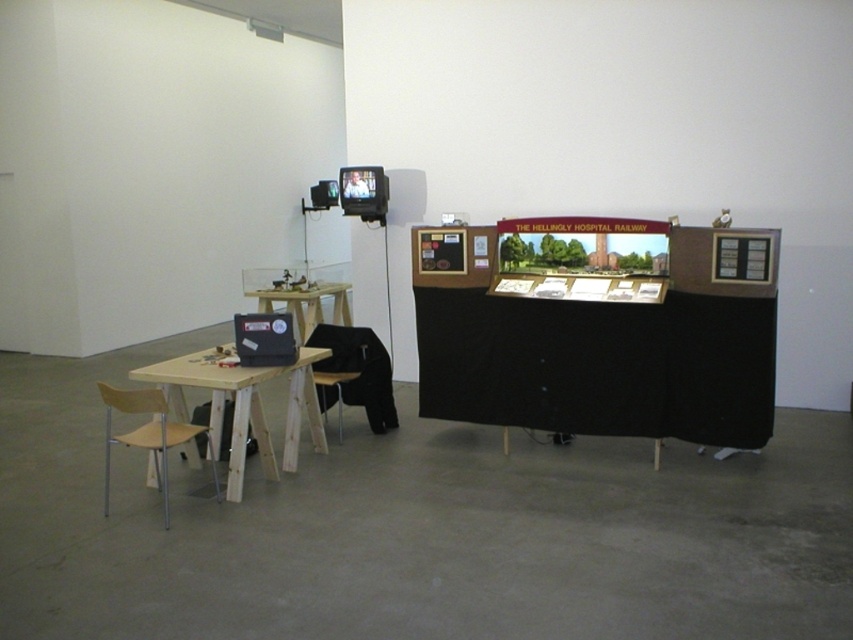
You are an event planner setting up for a presentation. You have a laptop and some tools that need to be placed on the wooden table at lower left and the light brown wooden chair at lower left. Considering their sizes, which object can accommodate more items?

The light brown wooden chair at lower left has a larger size than the wooden table at lower left, so it can accommodate more items.

You are an event planner setting up for a presentation. You need to move the light brown wooden chair at lower left closer to the wooden table at lower left. Based on their current positions, which direction should you move the chair to align it properly with the table?

The wooden table at lower left is located above the light brown wooden chair at lower left. To align the chair properly with the table, you should move the light brown wooden chair at lower left upward towards the wooden table at lower left.

You are an event planner setting up for a presentation. You have a black fabric chair at lower left and a wooden table at left. Where should you place the laptop to ensure it is accessible from the chair?

The black fabric chair at lower left is positioned under wooden table at left, so placing the laptop on the wooden table at left near the edge closest to the chair would ensure accessibility.